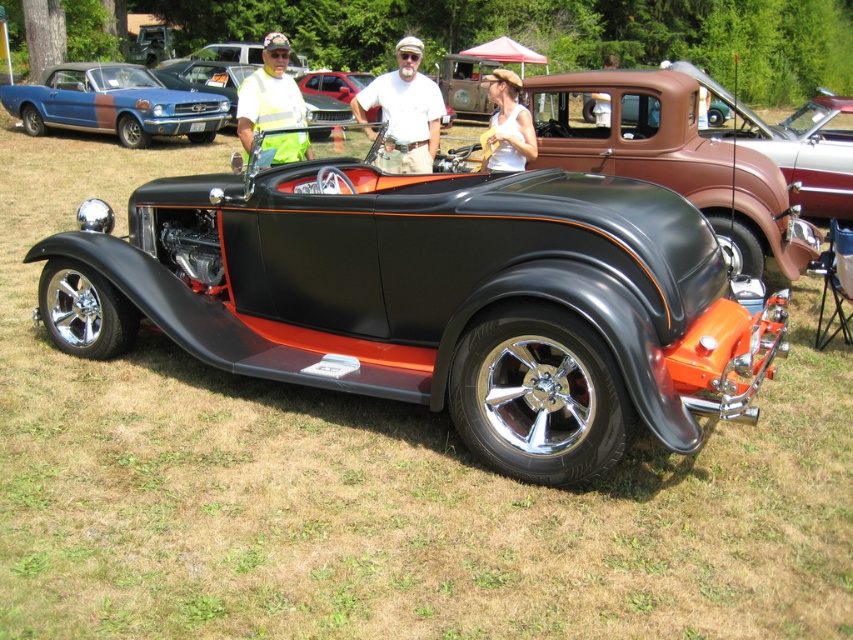
Question: Can you confirm if matte brown pickup truck at center is wider than matte white tank top at center?

Choices:
 (A) no
 (B) yes

Answer: (B)

Question: Can you confirm if matte blue and brown car at upper left is positioned below yellow reflective vest at center?

Choices:
 (A) no
 (B) yes

Answer: (A)

Question: Observing the image, what is the correct spatial positioning of matte brown pickup truck at center in reference to white cotton shirt at center?

Choices:
 (A) left
 (B) right

Answer: (B)

Question: Which point is farther to the camera?

Choices:
 (A) matte black shirt at center
 (B) yellow reflective vest at center

Answer: (A)

Question: Which object is farther from the camera taking this photo?

Choices:
 (A) white cotton shirt at center
 (B) yellow reflective vest at center

Answer: (A)

Question: Which point is closer to the camera taking this photo?

Choices:
 (A) [x=48, y=102]
 (B) [x=601, y=104]

Answer: (B)